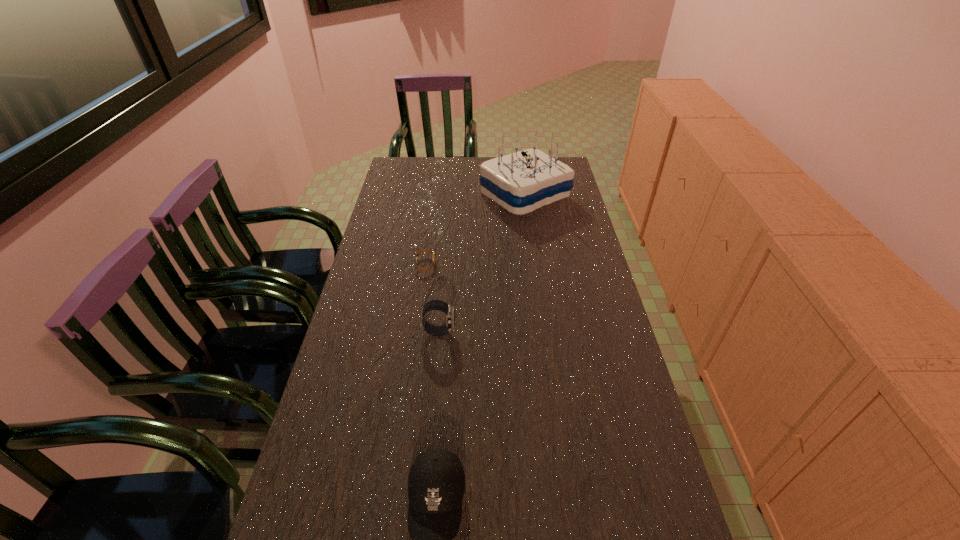
Identify the location of object that is at the right edge. The height and width of the screenshot is (540, 960). (520, 182).

This screenshot has width=960, height=540. Find the location of `object located in the far right corner section of the desktop`. object located in the far right corner section of the desktop is located at coordinates (520, 182).

The height and width of the screenshot is (540, 960). Find the location of `vacant space at the far edge`. vacant space at the far edge is located at coordinates (445, 158).

The image size is (960, 540). What are the coordinates of `vacant space at the left edge of the desktop` in the screenshot? It's located at (340, 394).

This screenshot has height=540, width=960. What are the coordinates of `vacant space at the right edge of the desktop` in the screenshot? It's located at (580, 346).

In the image, there is a desktop. Find the location of `free space at the far left corner`. free space at the far left corner is located at coordinates (396, 183).

Where is `free space between the third farthest object and the farthest object`? The width and height of the screenshot is (960, 540). free space between the third farthest object and the farthest object is located at coordinates (482, 263).

You are a GUI agent. You are given a task and a screenshot of the screen. Output one action in this format:
    pyautogui.click(x=<x>, y=<y>)
    Task: Click on the free space between the farthest object and the shortest object
    
    Given the screenshot: What is the action you would take?
    pyautogui.click(x=475, y=230)

Locate an element on the screen. free space between the rightmost object and the nearer watch is located at coordinates (482, 263).

Locate which object ranks second in proximity to the taller watch. Please provide its 2D coordinates. Your answer should be formatted as a tuple, i.e. [(x, y)], where the tuple contains the x and y coordinates of a point satisfying the conditions above.

[(436, 483)]